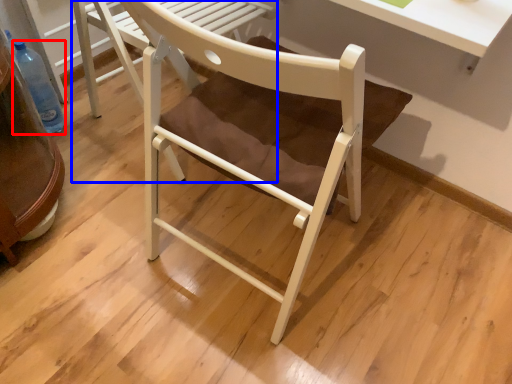
Question: Which of the following is the farthest to the observer, bottle (highlighted by a red box) or chair (highlighted by a blue box)?

Choices:
 (A) bottle
 (B) chair

Answer: (A)